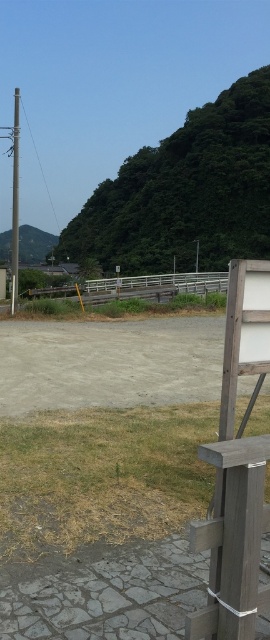
You are planning to place a small potted plant between the wooden bench at lower right and the metallic gray pole at left. Based on their sizes, which object should the plant be closer to?

The wooden bench at lower right has a smaller size compared to metallic gray pole at left, so the plant should be placed closer to the wooden bench at lower right to maintain balance.

You are standing at the point labeled as point (x=234, y=540) in the image. Which object are you currently on?

You are on the wooden bench at lower right because the point (x=234, y=540) is located on it.

You are standing at the entrance of a park and see the wooden bench at lower right and the metallic gray pole at left. Which object is closer to you?

The wooden bench at lower right is closer to you because it is in front of the metallic gray pole at left.